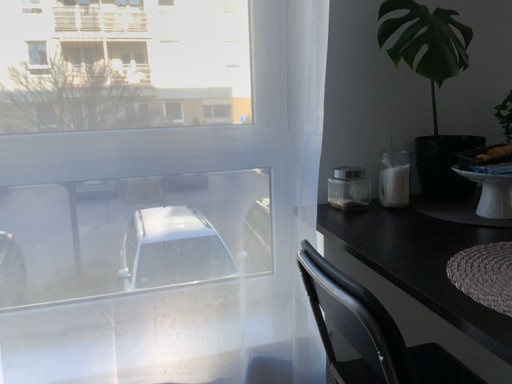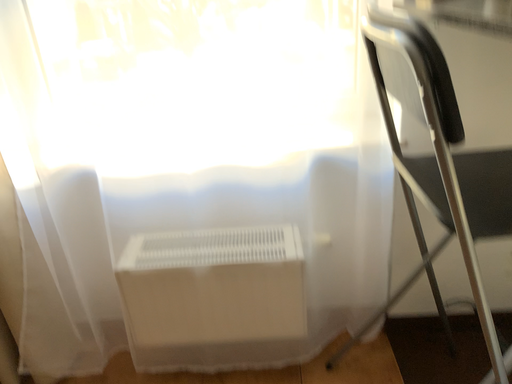
Question: How did the camera likely rotate when shooting the video?

Choices:
 (A) rotated right
 (B) rotated left

Answer: (B)